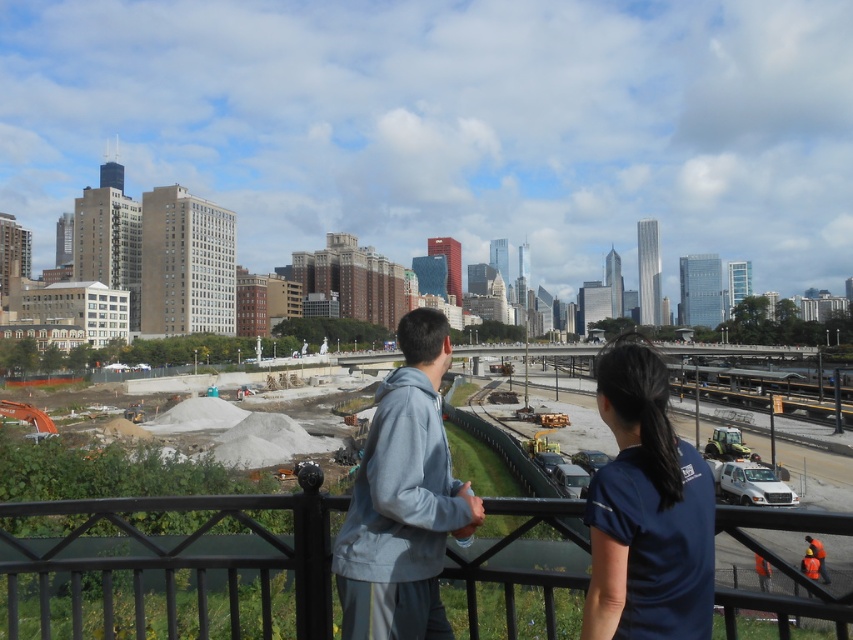
Question: Can you confirm if black metal railing at center is positioned above dark blue shirt at center?

Choices:
 (A) yes
 (B) no

Answer: (B)

Question: Is black metal railing at center to the right of light gray hoodie at center from the viewer's perspective?

Choices:
 (A) no
 (B) yes

Answer: (A)

Question: In this image, where is black metal railing at center located relative to gray fleece jacket at center?

Choices:
 (A) below
 (B) above

Answer: (A)

Question: Which point appears farthest from the camera in this image?

Choices:
 (A) (619, 548)
 (B) (419, 566)
 (C) (114, 509)

Answer: (C)

Question: Based on their relative distances, which object is farther from the light gray hoodie at center?

Choices:
 (A) gray fleece jacket at center
 (B) dark blue shirt at center
 (C) black metal railing at center

Answer: (C)

Question: Estimate the real-world distances between objects in this image. Which object is farther from the light gray hoodie at center?

Choices:
 (A) black metal railing at center
 (B) dark blue shirt at center

Answer: (A)